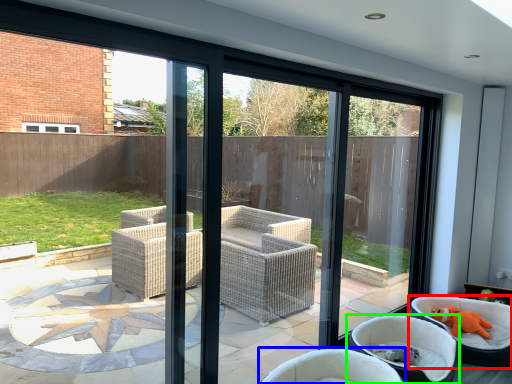
Question: Which is farther away from chair (highlighted by a red box)? chair (highlighted by a blue box) or chair (highlighted by a green box)?

Choices:
 (A) chair
 (B) chair

Answer: (A)